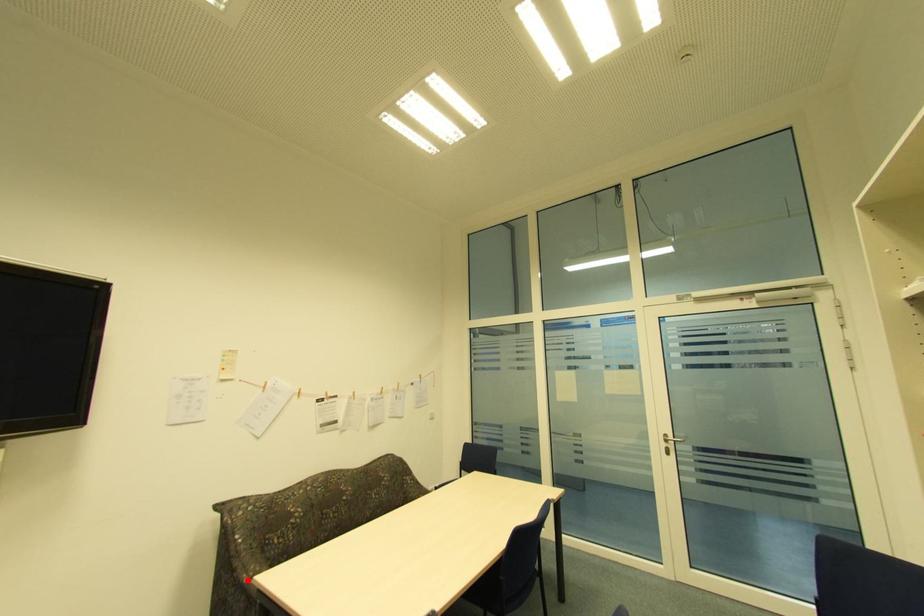
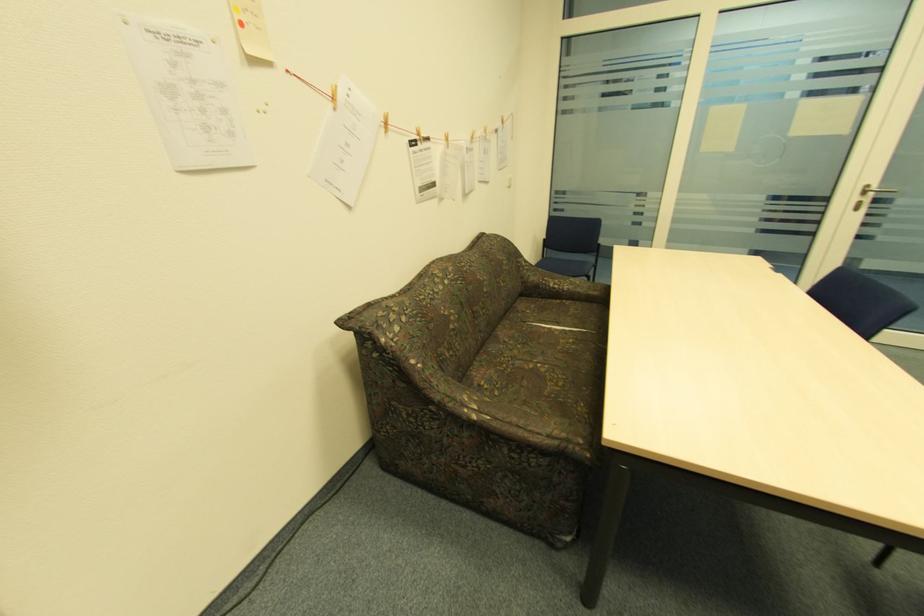
In the second image, find the point that corresponds to the highlighted location in the first image.

(477, 416)